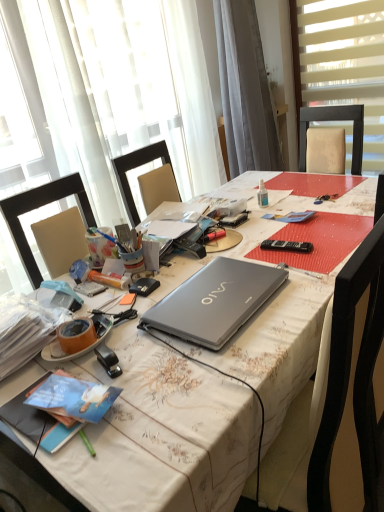
Where is `vacant area that lies between silver metallic laptop at center and clear plastic bottle at center`? The image size is (384, 512). vacant area that lies between silver metallic laptop at center and clear plastic bottle at center is located at coordinates (257, 238).